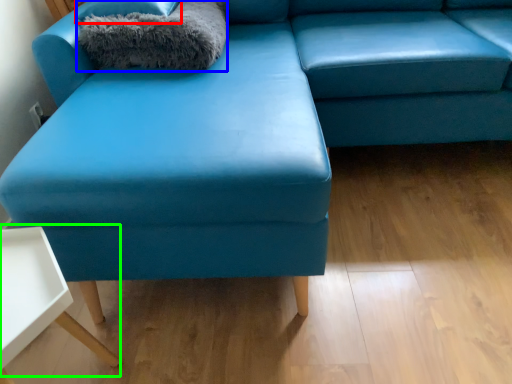
Question: Which object is the farthest from pillow (highlighted by a red box)? Choose among these: blanket (highlighted by a blue box) or table (highlighted by a green box).

Choices:
 (A) blanket
 (B) table

Answer: (B)